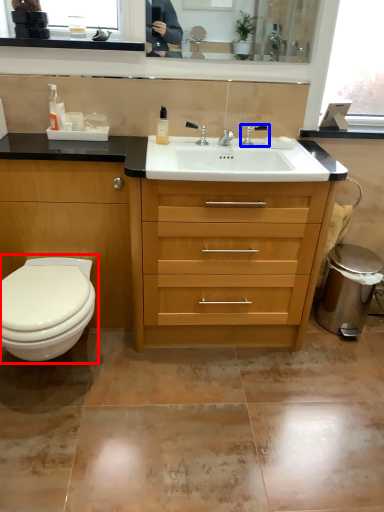
Question: Which point is closer to the camera, toilet (highlighted by a red box) or tap (highlighted by a blue box)?

Choices:
 (A) toilet
 (B) tap

Answer: (A)